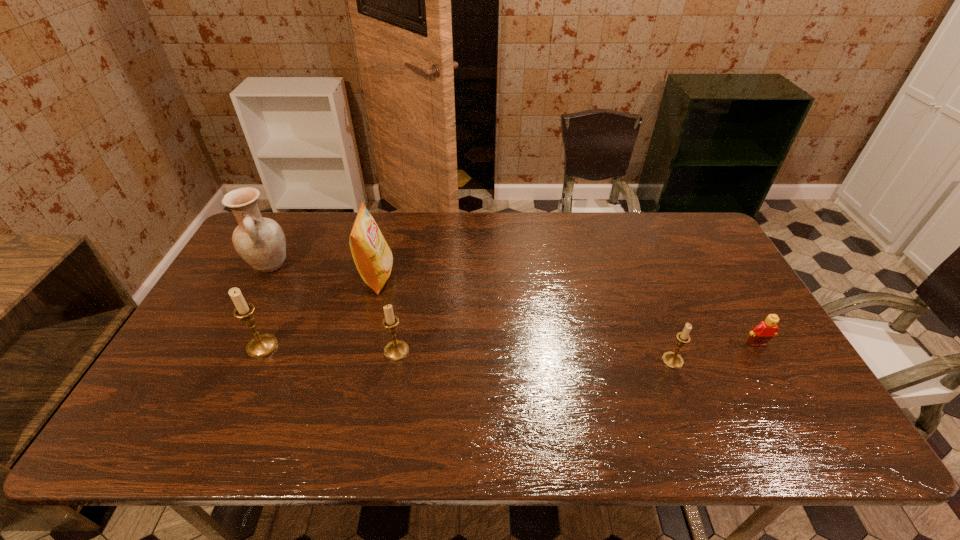
You are a GUI agent. You are given a task and a screenshot of the screen. Output one action in this format:
    pyautogui.click(x=<x>, y=<y>)
    Task: Click on the free spot located 0.100m on the front of the second tallest candle holder
    
    Given the screenshot: What is the action you would take?
    pyautogui.click(x=389, y=396)

Where is `free location located on the back of the rightmost candle holder`? The height and width of the screenshot is (540, 960). free location located on the back of the rightmost candle holder is located at coordinates (663, 338).

This screenshot has height=540, width=960. Find the location of `vacant area situated 0.330m on the front-facing side of the third object from left to right`. vacant area situated 0.330m on the front-facing side of the third object from left to right is located at coordinates 499,276.

The height and width of the screenshot is (540, 960). I want to click on vacant region located on the right of the pottery, so click(376, 265).

Where is `blank space located 0.170m on the face of the rightmost object`? Image resolution: width=960 pixels, height=540 pixels. blank space located 0.170m on the face of the rightmost object is located at coordinates (792, 406).

Where is `object at the far edge`? object at the far edge is located at coordinates (260, 241).

Locate an element on the screen. object positioned at the left edge is located at coordinates (260, 241).

Where is `object that is at the right edge`? This screenshot has height=540, width=960. object that is at the right edge is located at coordinates (765, 330).

Identify the location of object located in the far left corner section of the desktop. This screenshot has height=540, width=960. (260, 241).

This screenshot has width=960, height=540. In the image, there is a desktop. In order to click on free space at the far edge in this screenshot , I will do `click(612, 240)`.